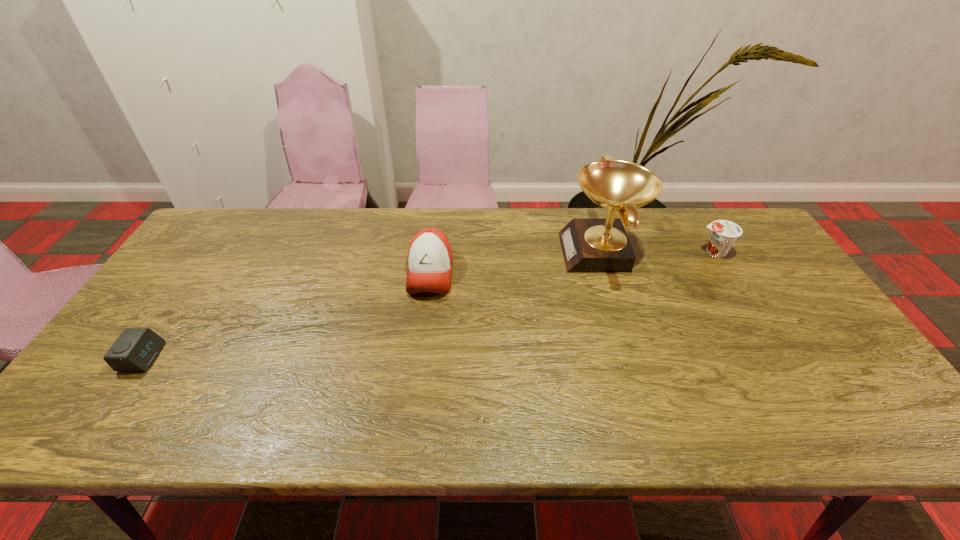
The width and height of the screenshot is (960, 540). I want to click on award, so click(590, 245).

Where is `the third object from left to right`? The width and height of the screenshot is (960, 540). the third object from left to right is located at coordinates click(x=590, y=245).

Locate an element on the screen. the third shortest object is located at coordinates (430, 257).

Locate an element on the screen. This screenshot has width=960, height=540. baseball cap is located at coordinates (430, 257).

Locate an element on the screen. The image size is (960, 540). the second shortest object is located at coordinates (724, 233).

I want to click on the rightmost object, so click(x=724, y=233).

You are a GUI agent. You are given a task and a screenshot of the screen. Output one action in this format:
    pyautogui.click(x=<x>, y=<y>)
    Task: Click on the shortest object
    
    Given the screenshot: What is the action you would take?
    pyautogui.click(x=136, y=349)

The image size is (960, 540). In order to click on alarm clock in this screenshot , I will do `click(136, 349)`.

Image resolution: width=960 pixels, height=540 pixels. Find the location of `free space located 0.350m on the front-facing side of the award`. free space located 0.350m on the front-facing side of the award is located at coordinates (451, 253).

Locate an element on the screen. This screenshot has height=540, width=960. vacant position located on the front-facing side of the award is located at coordinates (540, 253).